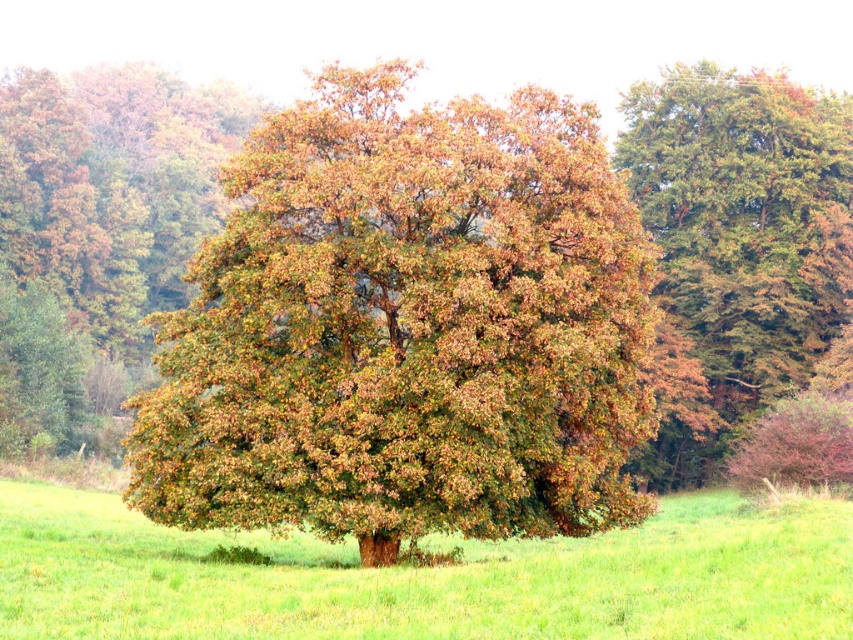
Question: Is brown leafy oak tree at center wider than green grass at center?

Choices:
 (A) no
 (B) yes

Answer: (A)

Question: Which point appears farthest from the camera in this image?

Choices:
 (A) (396, 612)
 (B) (816, 172)
 (C) (422, 241)

Answer: (B)

Question: Is brown leafy oak tree at center above green textured tree at upper right?

Choices:
 (A) no
 (B) yes

Answer: (A)

Question: Does brown leafy oak tree at center have a larger size compared to green grass at center?

Choices:
 (A) no
 (B) yes

Answer: (B)

Question: Which is nearer to the green textured tree at upper right?

Choices:
 (A) brown leafy oak tree at center
 (B) green grass at center

Answer: (B)

Question: Which point is farther to the camera?

Choices:
 (A) green grass at center
 (B) brown leafy oak tree at center

Answer: (B)